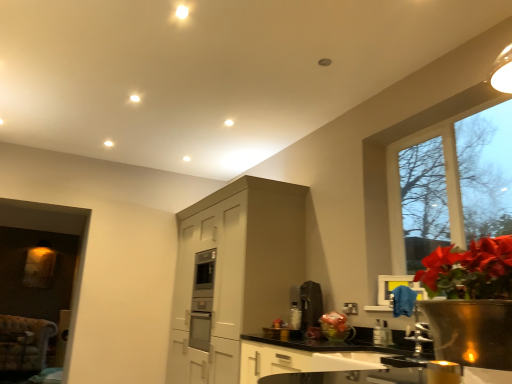
Question: Is clear glass window at upper right bigger or smaller than satin black coffee maker at center?

Choices:
 (A) big
 (B) small

Answer: (A)

Question: In terms of width, does clear glass window at upper right look wider or thinner when compared to satin black coffee maker at center?

Choices:
 (A) thin
 (B) wide

Answer: (A)

Question: Estimate the real-world distances between objects in this image. Which object is closer to the black granite countertop at center?

Choices:
 (A) translucent plastic vase at lower center
 (B) clear glass window at upper right
 (C) satin black coffee maker at center
 (D) satin nickel faucet at lower right
 (E) white glossy sink at lower center

Answer: (E)

Question: Which is nearer to the translucent plastic vase at lower center?

Choices:
 (A) clear glass window at upper right
 (B) white glossy sink at lower center
 (C) satin nickel faucet at lower right
 (D) satin black coffee maker at center
 (E) black granite countertop at center

Answer: (E)